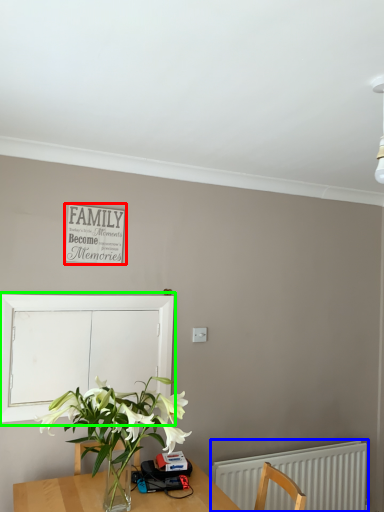
Question: Estimate the real-world distances between objects in this image. Which object is farther from bulletin board (highlighted by a red box), radiator (highlighted by a blue box) or window screen (highlighted by a green box)?

Choices:
 (A) radiator
 (B) window screen

Answer: (A)